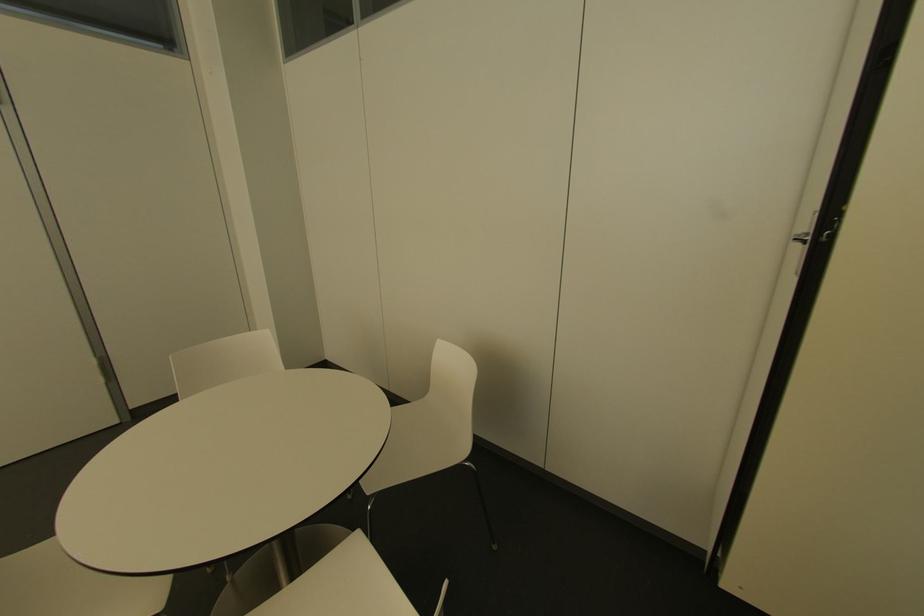
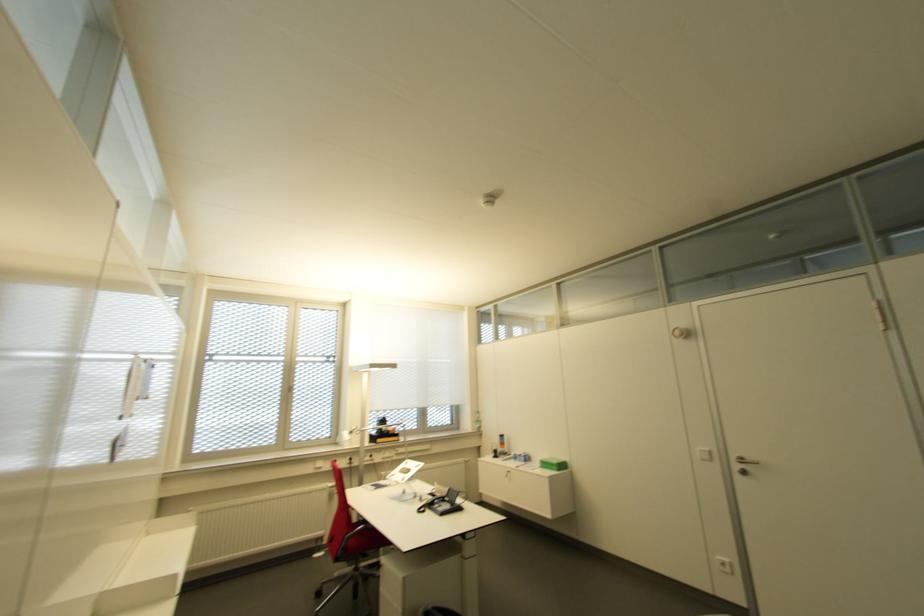
Question: The camera is either moving clockwise (left) or counter-clockwise (right) around the object. The first image is from the beginning of the video and the second image is from the end. Is the camera moving left or right when shooting the video?

Choices:
 (A) Left
 (B) Right

Answer: (B)